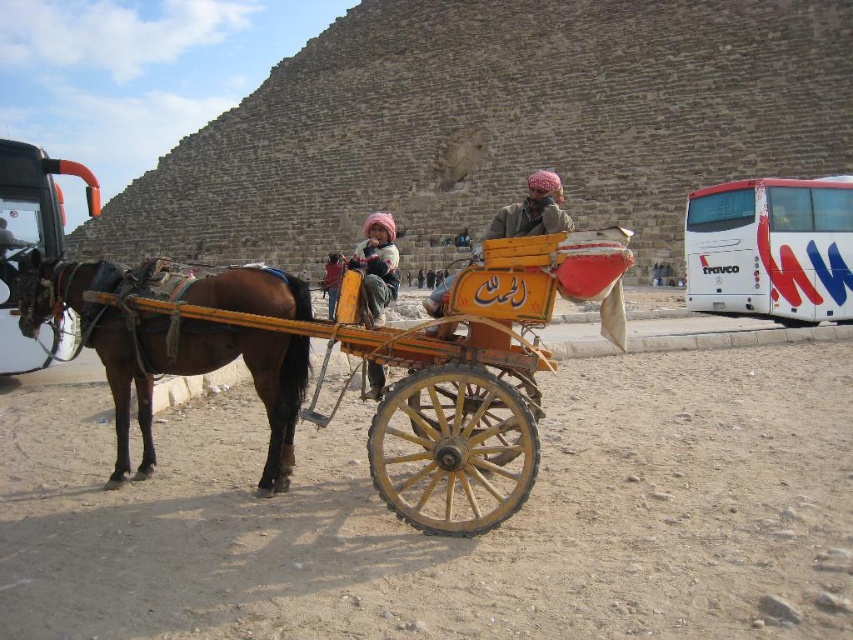
Looking at this image, you are standing at the center of the image. Which direction should you face to see the brown glossy horse at left?

The brown glossy horse at left is located at point 0.556 on the x axis and 0.196 on the y axis. Since you are at the center, you should face to the left to see the brown glossy horse at left.

You are a tourist visiting the Great Pyramid of Giza and you see the brown glossy horse at left and the soft pink fabric at center. Which object is closer to you?

The brown glossy horse at left is closer to you because it is in front of the soft pink fabric at center.